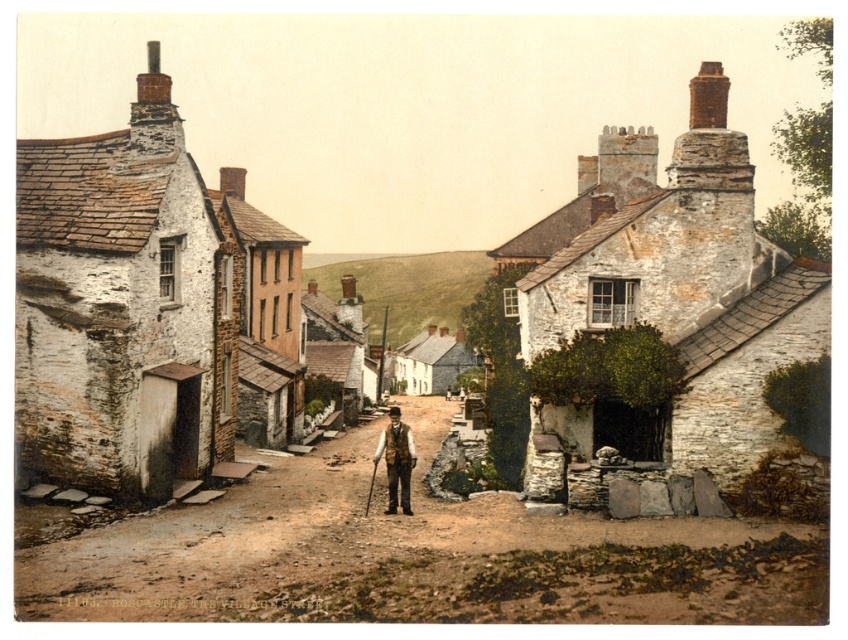
You are a traveler standing on the cobblestone street in the village. You notice the brown stone alley at center and the stone houses at center. Which one is located lower in the image?

The brown stone alley at center is below stone houses at center, so the brown stone alley at center is located lower in the image.

You are a traveler standing on the cobblestone street in the village. You see the brown stone alley at center and the brown leather vest at center. How far apart are these two items?

The brown stone alley at center and the brown leather vest at center are 3.89 meters apart from each other.

You are a delivery person with a cart that can only fit through spaces narrower than 2 meters. You need to navigate through the village street. Can you pass through the brown stone alley at center without going through the stone houses at center?

The brown stone alley at center is smaller than the stone houses at center. Since the alley is smaller, it is likely narrower than the houses. If the alley is narrower than 2 meters, the cart can pass through. However, without specific measurements, we can infer that since the alley is designed for passage, it might be wide enough. But according to the description, the alley is smaller in size, so it might be too narrow. Therefore, it is uncertain without exact dimensions.